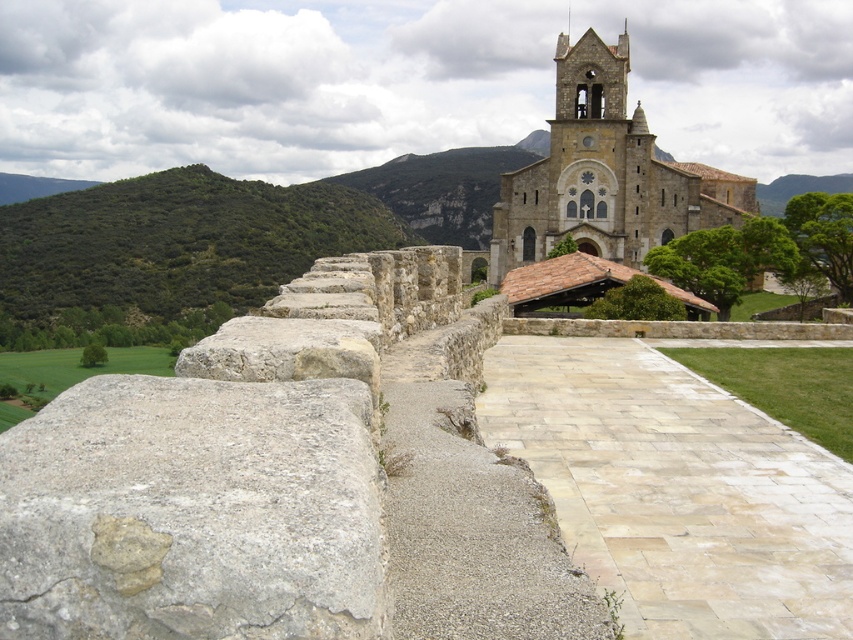
Is gray rough stone at left closer to camera compared to stone church at center?

Yes.

Can you confirm if gray rough stone at left is positioned to the right of stone church at center?

No, gray rough stone at left is not to the right of stone church at center.

Is point (224, 422) positioned in front of point (563, 64)?

Yes, point (224, 422) is closer to viewer.

In order to click on gray rough stone at left in this screenshot , I will do `click(192, 512)`.